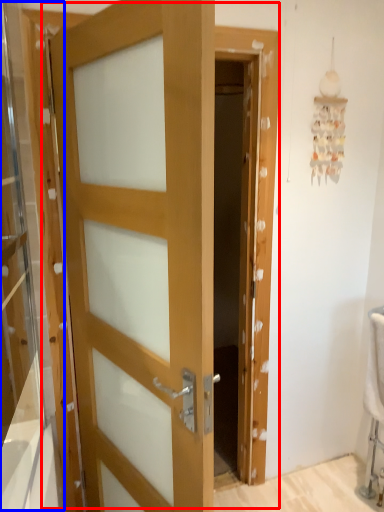
Question: Among these objects, which one is farthest to the camera, door (highlighted by a red box) or glass door (highlighted by a blue box)?

Choices:
 (A) door
 (B) glass door

Answer: (A)